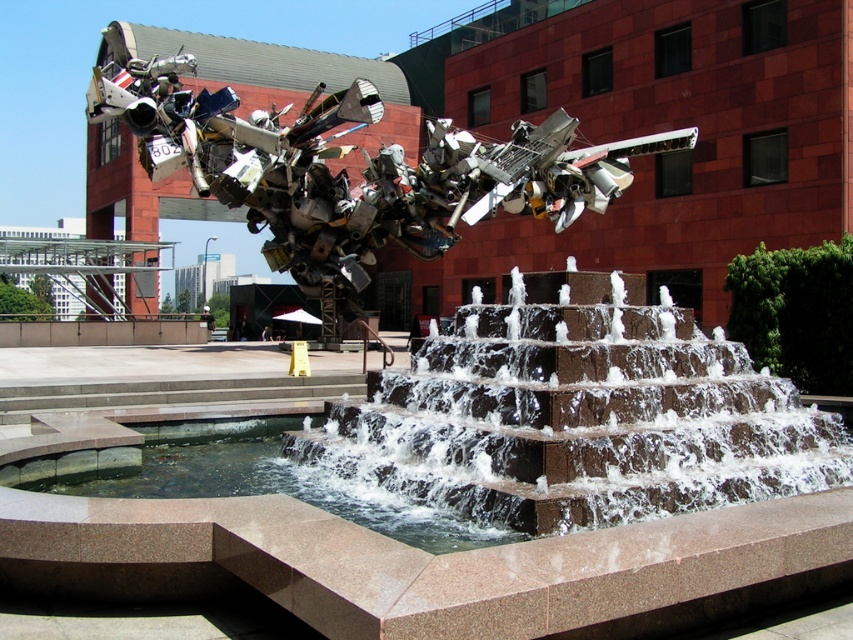
Question: Among these objects, which one is nearest to the camera?

Choices:
 (A) clear water at bottom center
 (B) brown stone fountain at center

Answer: (B)

Question: Is brown stone fountain at center to the left of clear water at bottom center from the viewer's perspective?

Choices:
 (A) yes
 (B) no

Answer: (B)

Question: Does brown stone fountain at center come in front of clear water at bottom center?

Choices:
 (A) yes
 (B) no

Answer: (A)

Question: Is brown stone fountain at center positioned at the back of clear water at bottom center?

Choices:
 (A) yes
 (B) no

Answer: (B)